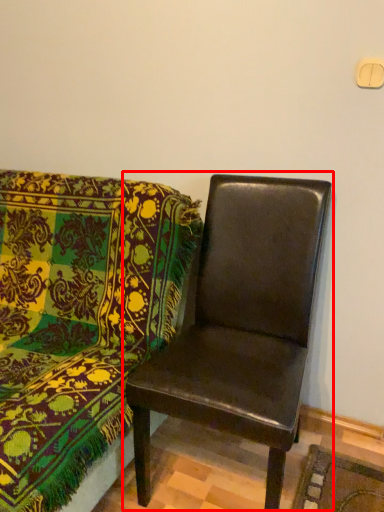
Question: Observing the image, what is the correct spatial positioning of chair (annotated by the red box) in reference to chair?

Choices:
 (A) left
 (B) right

Answer: (B)